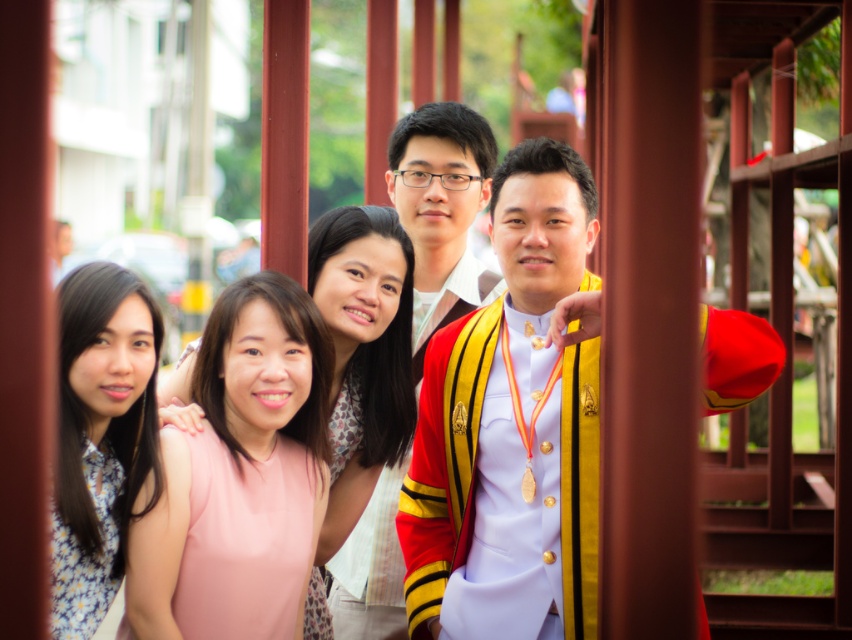
Question: Is red velvet suit at center above yellow striped sash at center?

Choices:
 (A) no
 (B) yes

Answer: (A)

Question: Estimate the real-world distances between objects in this image. Which object is closer to the pink fabric dress at center?

Choices:
 (A) red velvet suit at center
 (B) floral print dress at left
 (C) yellow striped sash at center

Answer: (C)

Question: Which of the following is the closest to the observer?

Choices:
 (A) floral print dress at left
 (B) pink fabric dress at center

Answer: (A)

Question: Which point is closer to the camera taking this photo?

Choices:
 (A) (337, 493)
 (B) (568, 266)
 (C) (384, 516)

Answer: (B)

Question: Is yellow striped sash at center above pink fabric dress at center?

Choices:
 (A) yes
 (B) no

Answer: (A)

Question: Does red velvet suit at center appear on the right side of yellow striped sash at center?

Choices:
 (A) yes
 (B) no

Answer: (A)